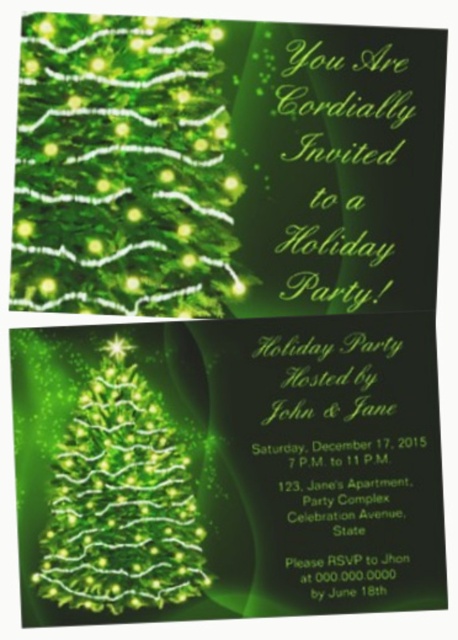
Question: In this image, where is green matte christmas tree at center located relative to green glittering christmas tree at center?

Choices:
 (A) below
 (B) above

Answer: (B)

Question: In this image, where is green matte christmas tree at center located relative to green glittering christmas tree at center?

Choices:
 (A) below
 (B) above

Answer: (B)

Question: Does green matte christmas tree at center have a smaller size compared to green glittering christmas tree at center?

Choices:
 (A) yes
 (B) no

Answer: (B)

Question: Which object is farther from the camera taking this photo?

Choices:
 (A) green matte christmas tree at center
 (B) green glittering christmas tree at center

Answer: (B)

Question: Among these objects, which one is farthest from the camera?

Choices:
 (A) green glittering christmas tree at center
 (B) green matte christmas tree at center

Answer: (A)